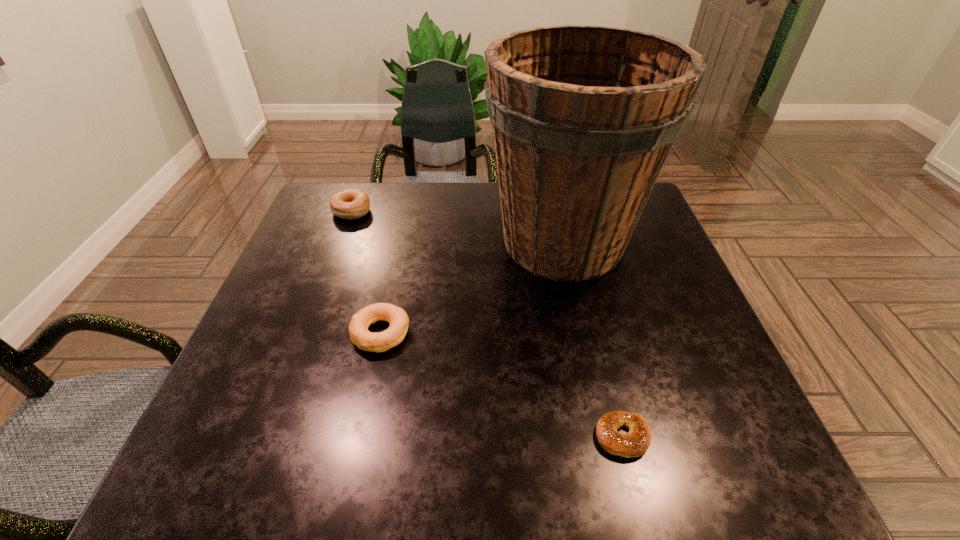
Locate an element on the screen. This screenshot has width=960, height=540. free area in between the rightmost bagel and the bucket is located at coordinates (592, 339).

Image resolution: width=960 pixels, height=540 pixels. What are the coordinates of `free space between the rightmost bagel and the third tallest object` in the screenshot? It's located at (501, 385).

Locate an element on the screen. free space between the nearest bagel and the bucket is located at coordinates (592, 339).

Where is `vacant space that's between the bucket and the shortest object`? The height and width of the screenshot is (540, 960). vacant space that's between the bucket and the shortest object is located at coordinates (592, 339).

Where is `vacant area between the second tallest object and the shortest object`? The height and width of the screenshot is (540, 960). vacant area between the second tallest object and the shortest object is located at coordinates (487, 325).

The image size is (960, 540). What are the coordinates of `object that ranks as the second closest to the third farthest object` in the screenshot? It's located at (350, 203).

Locate which object is the third closest to the second tallest object. Please provide its 2D coordinates. Your answer should be formatted as a tuple, i.e. [(x, y)], where the tuple contains the x and y coordinates of a point satisfying the conditions above.

[(633, 444)]

Locate which bagel ranks in proximity to the second bagel from left to right. Please provide its 2D coordinates. Your answer should be formatted as a tuple, i.e. [(x, y)], where the tuple contains the x and y coordinates of a point satisfying the conditions above.

[(350, 203)]

At what (x,y) coordinates should I click in order to perform the action: click on bagel that stands as the second closest to the leftmost object. Please return your answer as a coordinate pair (x, y). The image size is (960, 540). Looking at the image, I should click on (633, 444).

Locate an element on the screen. The width and height of the screenshot is (960, 540). vacant point that satisfies the following two spatial constraints: 1. on the back side of the second object from left to right; 2. on the right side of the tallest object is located at coordinates (399, 241).